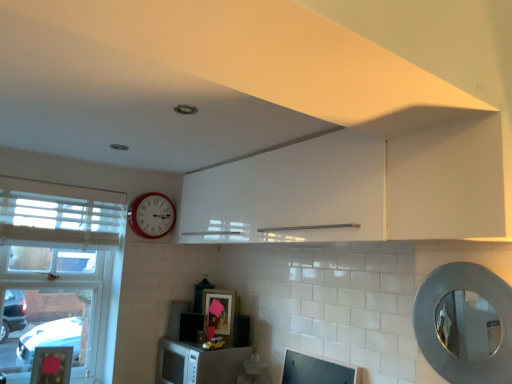
Question: From the image's perspective, is matte black monitor at lower center below white matte microwave at lower center?

Choices:
 (A) no
 (B) yes

Answer: (A)

Question: Is matte black monitor at lower center smaller than white matte microwave at lower center?

Choices:
 (A) yes
 (B) no

Answer: (A)

Question: Does matte black monitor at lower center have a greater width compared to white matte microwave at lower center?

Choices:
 (A) no
 (B) yes

Answer: (A)

Question: Is matte black monitor at lower center to the left of white matte microwave at lower center from the viewer's perspective?

Choices:
 (A) no
 (B) yes

Answer: (A)

Question: Is white matte microwave at lower center completely or partially inside matte black monitor at lower center?

Choices:
 (A) yes
 (B) no

Answer: (B)

Question: Considering the positions of matte black picture frame at center and silver textured mirror at right in the image, is matte black picture frame at center wider or thinner than silver textured mirror at right?

Choices:
 (A) thin
 (B) wide

Answer: (A)

Question: In the image, is matte black picture frame at center on the left side or the right side of silver textured mirror at right?

Choices:
 (A) left
 (B) right

Answer: (A)

Question: Considering the positions of matte black picture frame at center and silver textured mirror at right in the image, is matte black picture frame at center taller or shorter than silver textured mirror at right?

Choices:
 (A) short
 (B) tall

Answer: (A)

Question: In the image, is matte black picture frame at center positioned in front of or behind silver textured mirror at right?

Choices:
 (A) front
 (B) behind

Answer: (B)

Question: Is point (454, 190) closer or farther from the camera than point (246, 342)?

Choices:
 (A) farther
 (B) closer

Answer: (B)

Question: Relative to black matte microwave at center, acting as the 2th appliance starting from the back, is white glossy cabinet at upper center in front or behind?

Choices:
 (A) behind
 (B) front

Answer: (B)

Question: Considering the relative positions of white glossy cabinet at upper center and black matte microwave at center, acting as the first appliance starting from the right, in the image provided, is white glossy cabinet at upper center to the left or to the right of black matte microwave at center, acting as the first appliance starting from the right,?

Choices:
 (A) left
 (B) right

Answer: (B)

Question: In terms of width, does white glossy cabinet at upper center look wider or thinner when compared to black matte microwave at center, acting as the 2th appliance starting from the back?

Choices:
 (A) wide
 (B) thin

Answer: (A)

Question: From a real-world perspective, is satin black microwave at lower center, which is counted as the second appliance, starting from the front, positioned above or below silver textured mirror at right?

Choices:
 (A) below
 (B) above

Answer: (A)

Question: Considering their positions, is satin black microwave at lower center, positioned as the 1th appliance in left-to-right order, located in front of or behind silver textured mirror at right?

Choices:
 (A) behind
 (B) front

Answer: (A)